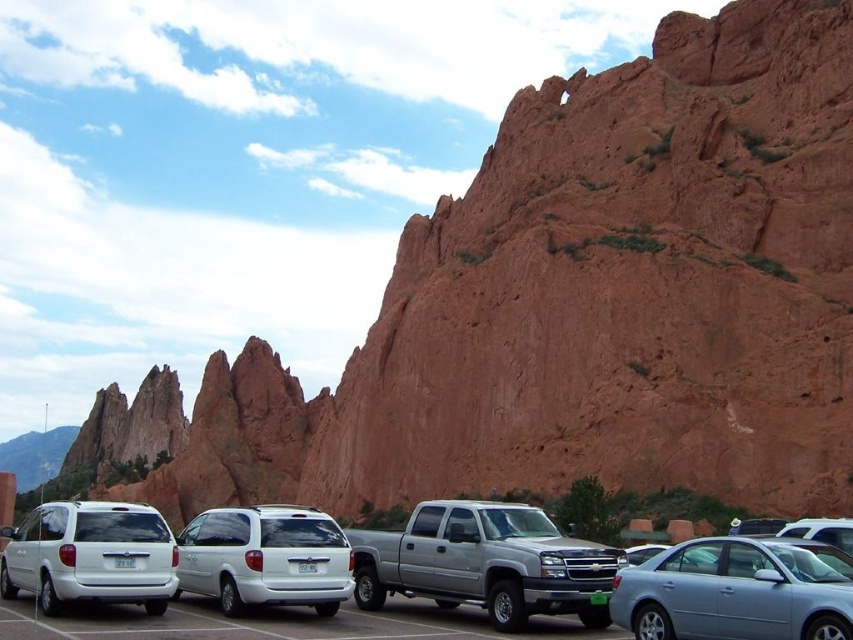
You are a delivery driver who needs to exit the parking lot. You see the silver metallic truck at center and the white matte suv at center. Which vehicle should you move around to exit the parking lot?

The white matte suv at center is behind the silver metallic truck at center, so you should move around the silver metallic truck at center to exit the parking lot.